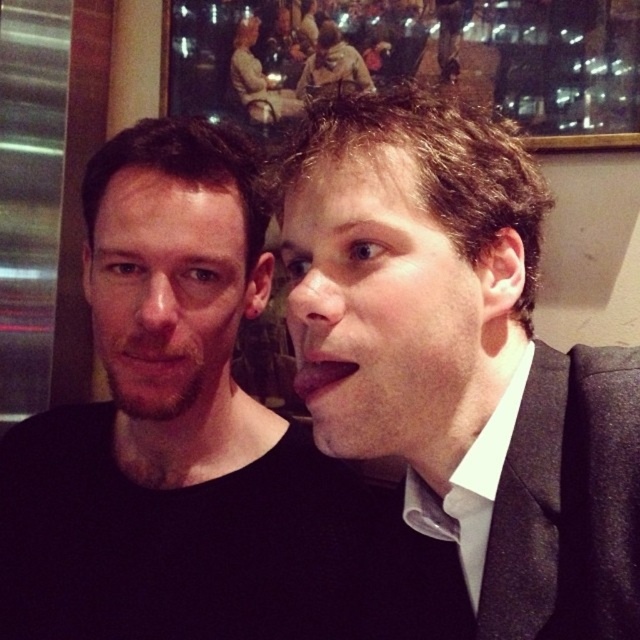
Based on the photo, which is above, dark brown hair at right or black matte shirt at left?

dark brown hair at right

Does point (564, 497) come in front of point (138, 436)?

Yes, point (564, 497) is closer to viewer.

Find the location of `dark brown hair at right`. dark brown hair at right is located at coordinates (458, 372).

Identify the location of dark gray wool business suit at right. This screenshot has width=640, height=640. (531, 520).

Between point (541, 628) and point (339, 54), which one is positioned in front?

Point (541, 628) is in front.

Find the location of a particular element. dark gray wool business suit at right is located at coordinates (531, 520).

Which is in front, point (410, 416) or point (572, 349)?

Point (410, 416) is more forward.

Does point (476, 284) come behind point (481, 592)?

No, (476, 284) is in front of (481, 592).

Is point (356, 305) positioned behind point (554, 593)?

No, it is in front of (554, 593).

I want to click on matte skin face at center, so click(x=384, y=314).